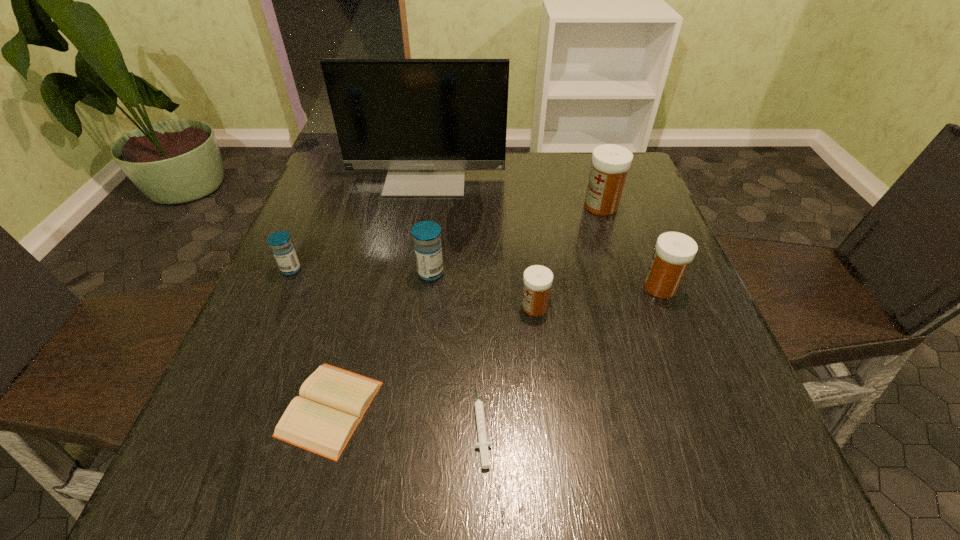
The image size is (960, 540). In order to click on object situated at the far right corner in this screenshot , I will do `click(610, 163)`.

In the image, there is a desktop. Where is `vacant space at the left edge`? vacant space at the left edge is located at coordinates (336, 202).

Identify the location of free space at the right edge of the desktop. (649, 245).

Locate an element on the screen. Image resolution: width=960 pixels, height=540 pixels. vacant space at the far left corner is located at coordinates coord(340,186).

This screenshot has width=960, height=540. I want to click on free point between the third object from right to left and the second biggest white medicine, so click(x=597, y=297).

Locate an element on the screen. free space between the smaller blue medicine and the tallest object is located at coordinates (359, 222).

You are a GUI agent. You are given a task and a screenshot of the screen. Output one action in this format:
    pyautogui.click(x=<x>, y=<y>)
    Task: Click on the free space between the fourth medicine from right to left and the second tallest object
    
    Given the screenshot: What is the action you would take?
    pyautogui.click(x=516, y=239)

Identify the location of free spot between the computer monitor and the leftmost medicine. The image size is (960, 540). (359, 222).

Identify the location of empty space that is in between the syringe and the third medicine from right to left. (509, 366).

Where is `free point between the second biggest white medicine and the syringe`? This screenshot has height=540, width=960. free point between the second biggest white medicine and the syringe is located at coordinates (571, 355).